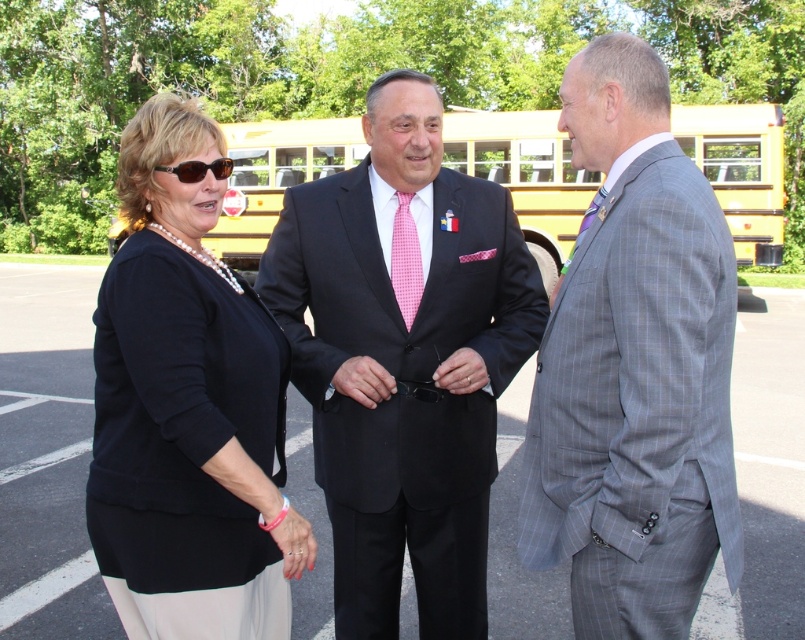
Between black matte cardigan at left and black plastic sunglasses at upper left, which one appears on the right side from the viewer's perspective?

black plastic sunglasses at upper left is more to the right.

Who is lower down, black matte cardigan at left or black plastic sunglasses at upper left?

black matte cardigan at left

What do you see at coordinates (188, 410) in the screenshot?
I see `black matte cardigan at left` at bounding box center [188, 410].

Where is `black matte cardigan at left`? This screenshot has height=640, width=805. black matte cardigan at left is located at coordinates (188, 410).

Is gray checkered suit at right to the right of black plastic sunglasses at upper left from the viewer's perspective?

Correct, you'll find gray checkered suit at right to the right of black plastic sunglasses at upper left.

Between gray checkered suit at right and black plastic sunglasses at upper left, which one appears on the left side from the viewer's perspective?

From the viewer's perspective, black plastic sunglasses at upper left appears more on the left side.

Which is behind, point (601, 536) or point (219, 163)?

Point (219, 163)

You are a GUI agent. You are given a task and a screenshot of the screen. Output one action in this format:
    pyautogui.click(x=<x>, y=<y>)
    Task: Click on the gray checkered suit at right
    
    Given the screenshot: What is the action you would take?
    pyautogui.click(x=634, y=369)

Can you confirm if matte black suit at center is thinner than yellow painted bus at center?

Correct, matte black suit at center's width is less than yellow painted bus at center's.

Does matte black suit at center appear over yellow painted bus at center?

Actually, matte black suit at center is below yellow painted bus at center.

Which is in front, point (484, 490) or point (552, 136)?

Point (484, 490)

The height and width of the screenshot is (640, 805). I want to click on matte black suit at center, so click(x=403, y=358).